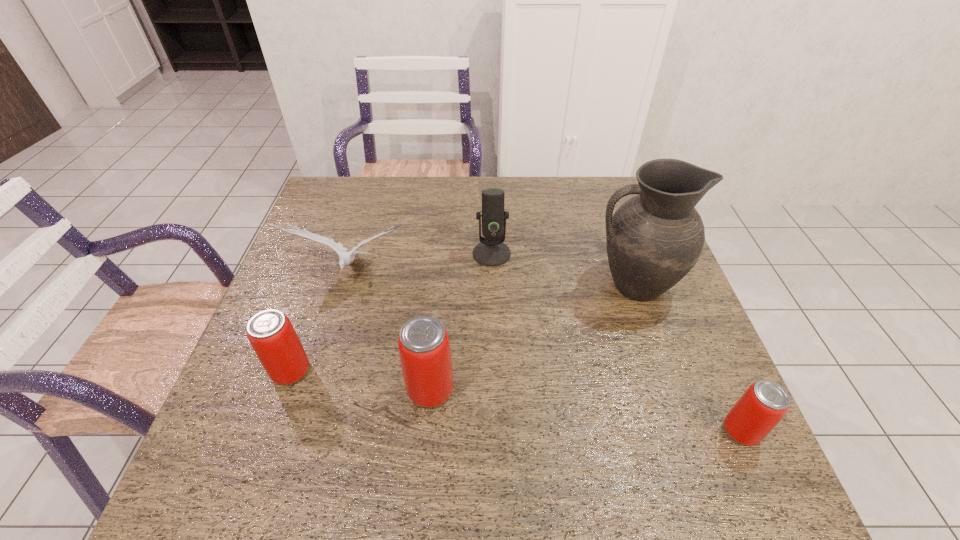
Locate an element on the screen. Image resolution: width=960 pixels, height=540 pixels. vacant space at the far edge of the desktop is located at coordinates (449, 207).

Identify the location of vacant space at the near edge of the desktop. (391, 426).

The height and width of the screenshot is (540, 960). What are the coordinates of `free space at the left edge` in the screenshot? It's located at (268, 377).

Where is `vacant space at the right edge of the desktop`? vacant space at the right edge of the desktop is located at coordinates (694, 348).

Locate an element on the screen. This screenshot has height=540, width=960. vacant space at the far left corner of the desktop is located at coordinates (348, 185).

Where is `blank space at the near left corner of the desktop`? The height and width of the screenshot is (540, 960). blank space at the near left corner of the desktop is located at coordinates (212, 430).

Identify the location of vacant area at the near right corner of the desktop. (719, 429).

I want to click on vacant area between the tallest object and the leftmost beer can, so click(462, 328).

The image size is (960, 540). Find the location of `vacant area that lies between the shortest beer can and the pitcher`. vacant area that lies between the shortest beer can and the pitcher is located at coordinates (687, 358).

Find the location of a particular element. The image size is (960, 540). vacant area between the fourth object from right to left and the third object from right to left is located at coordinates (461, 322).